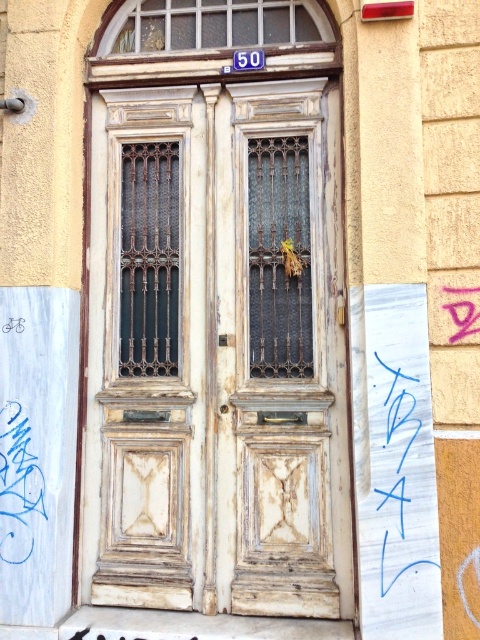
You are a delivery person trying to find apartment 50B. You see the white weathered wood door at center and the blue marker writing at center. Which one is located to the left of the other?

The white weathered wood door at center is positioned on the left side of blue marker writing at center.